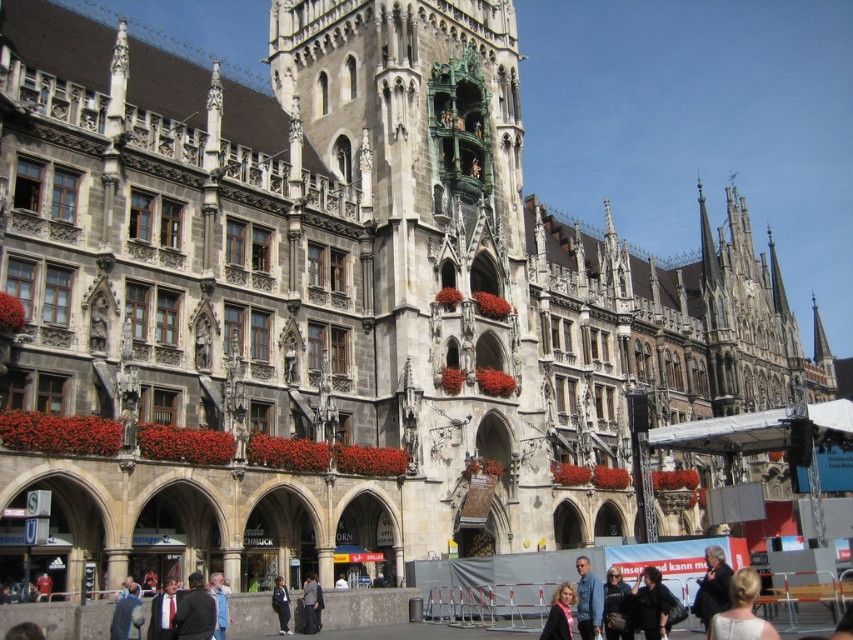
Who is taller, dark suit at center or dark gray suit at center?

dark suit at center

Between dark suit at center and dark gray suit at center, which one is positioned higher?

dark suit at center is higher up.

The width and height of the screenshot is (853, 640). What do you see at coordinates (195, 611) in the screenshot?
I see `dark suit at center` at bounding box center [195, 611].

Locate an element on the screen. The image size is (853, 640). dark suit at center is located at coordinates (195, 611).

Does black fabric jacket at lower center have a larger size compared to dark gray jacket at lower center?

Yes.

The width and height of the screenshot is (853, 640). In order to click on black fabric jacket at lower center in this screenshot , I will do `click(653, 604)`.

Who is positioned more to the left, white fabric dress at lower right or blue denim jacket at lower right?

Positioned to the left is blue denim jacket at lower right.

Is white fabric dress at lower right closer to camera compared to blue denim jacket at lower right?

That is True.

Which is behind, point (706, 637) or point (581, 576)?

The point (581, 576) is more distant.

Identify the location of white fabric dress at lower right. The image size is (853, 640). tap(741, 611).